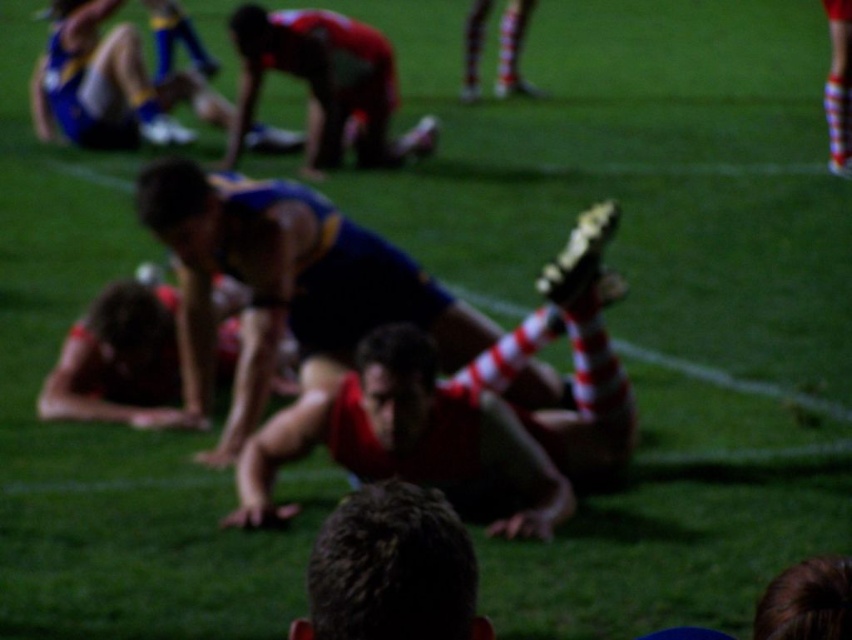
Which is above, red and white striped sock at center or dark brown hair at center?

dark brown hair at center is above.

Is red and white striped sock at center closer to camera compared to dark brown hair at center?

No.

Is point (370, 412) positioned after point (349, 552)?

Yes, point (370, 412) is farther from viewer.

Identify the location of red and white striped sock at center. (468, 410).

Does dark brown hair at center have a larger size compared to red fabric man at upper center?

Incorrect, dark brown hair at center is not larger than red fabric man at upper center.

Who is shorter, dark brown hair at center or red fabric man at upper center?

dark brown hair at center

Locate an element on the screen. dark brown hair at center is located at coordinates (390, 570).

The image size is (852, 640). I want to click on dark brown hair at center, so click(x=390, y=570).

Does red and white striped sock at center appear on the left side of red fabric man at upper center?

In fact, red and white striped sock at center is to the right of red fabric man at upper center.

Which is behind, point (606, 454) or point (331, 86)?

Point (331, 86)

This screenshot has height=640, width=852. I want to click on red and white striped sock at center, so click(x=468, y=410).